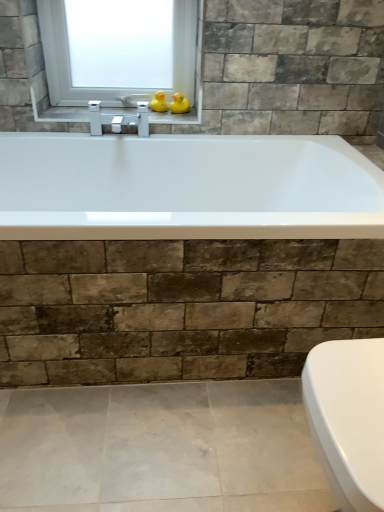
Question: Is rubber duck at upper center, which is the second duck in right-to-left order, smaller than metallic silver faucet at upper center?

Choices:
 (A) yes
 (B) no

Answer: (A)

Question: Can you confirm if rubber duck at upper center, which is the second duck in right-to-left order, is shorter than metallic silver faucet at upper center?

Choices:
 (A) no
 (B) yes

Answer: (A)

Question: Is rubber duck at upper center, which is the second duck in right-to-left order, not near metallic silver faucet at upper center?

Choices:
 (A) yes
 (B) no

Answer: (B)

Question: Is rubber duck at upper center, the first duck in the left-to-right sequence, facing towards metallic silver faucet at upper center?

Choices:
 (A) yes
 (B) no

Answer: (B)

Question: Considering the relative sizes of rubber duck at upper center, the first duck in the left-to-right sequence, and metallic silver faucet at upper center in the image provided, is rubber duck at upper center, the first duck in the left-to-right sequence, thinner than metallic silver faucet at upper center?

Choices:
 (A) yes
 (B) no

Answer: (A)

Question: From a real-world perspective, is rubber duck at upper center, the first duck in the left-to-right sequence, positioned under metallic silver faucet at upper center based on gravity?

Choices:
 (A) no
 (B) yes

Answer: (A)

Question: Is rubber duck at upper center, the first duck in the left-to-right sequence, oriented away from yellow rubber duck at upper center, which is counted as the second duck, starting from the left?

Choices:
 (A) yes
 (B) no

Answer: (B)

Question: Does rubber duck at upper center, the first duck in the left-to-right sequence, have a lesser width compared to yellow rubber duck at upper center, positioned as the 1th duck in right-to-left order?

Choices:
 (A) no
 (B) yes

Answer: (A)

Question: From a real-world perspective, is rubber duck at upper center, which is the second duck in right-to-left order, on top of yellow rubber duck at upper center, positioned as the 1th duck in right-to-left order?

Choices:
 (A) no
 (B) yes

Answer: (A)

Question: Is rubber duck at upper center, which is the second duck in right-to-left order, oriented towards yellow rubber duck at upper center, positioned as the 1th duck in right-to-left order?

Choices:
 (A) yes
 (B) no

Answer: (B)

Question: From a real-world perspective, is rubber duck at upper center, the first duck in the left-to-right sequence, physically below yellow rubber duck at upper center, positioned as the 1th duck in right-to-left order?

Choices:
 (A) yes
 (B) no

Answer: (A)

Question: Considering the relative sizes of rubber duck at upper center, which is the second duck in right-to-left order, and yellow rubber duck at upper center, which is counted as the second duck, starting from the left, in the image provided, is rubber duck at upper center, which is the second duck in right-to-left order, smaller than yellow rubber duck at upper center, which is counted as the second duck, starting from the left,?

Choices:
 (A) yes
 (B) no

Answer: (A)

Question: Considering the relative positions of transparent glass window at upper center and metallic silver faucet at upper center in the image provided, is transparent glass window at upper center in front of metallic silver faucet at upper center?

Choices:
 (A) no
 (B) yes

Answer: (B)